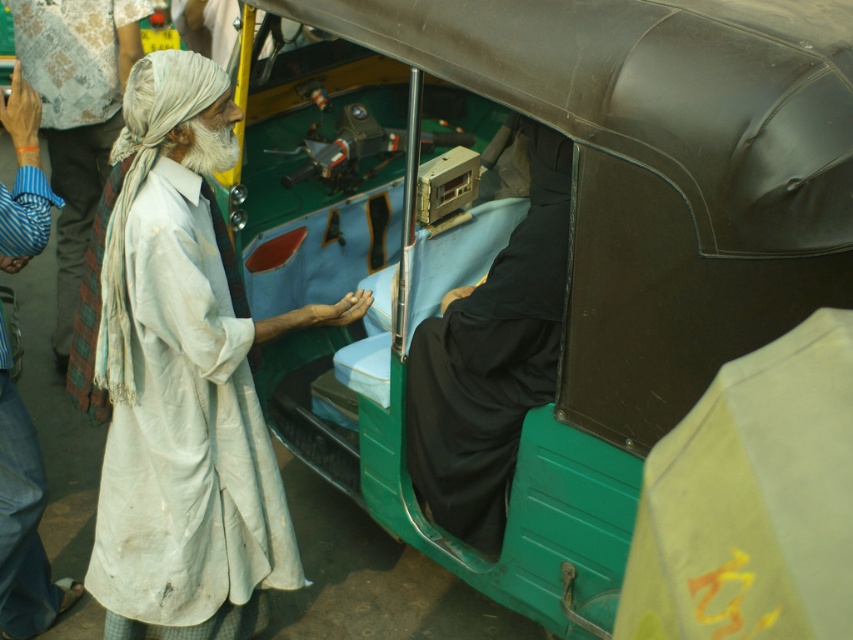
Question: Is green plastic motor vehicle at center to the right of black matte robe at center from the viewer's perspective?

Choices:
 (A) yes
 (B) no

Answer: (A)

Question: Which point is closer to the camera?

Choices:
 (A) white cotton robe at left
 (B) white cloth at left
 (C) green plastic motor vehicle at center

Answer: (C)

Question: Does green plastic motor vehicle at center appear on the right side of white cloth at left?

Choices:
 (A) no
 (B) yes

Answer: (B)

Question: Which object is farther from the camera taking this photo?

Choices:
 (A) white cloth at left
 (B) green plastic motor vehicle at center
 (C) black matte robe at center
 (D) white cotton robe at left

Answer: (D)

Question: Does green plastic motor vehicle at center appear under white cloth at left?

Choices:
 (A) yes
 (B) no

Answer: (B)

Question: Among these objects, which one is nearest to the camera?

Choices:
 (A) green plastic motor vehicle at center
 (B) white cloth at left
 (C) black matte robe at center

Answer: (A)